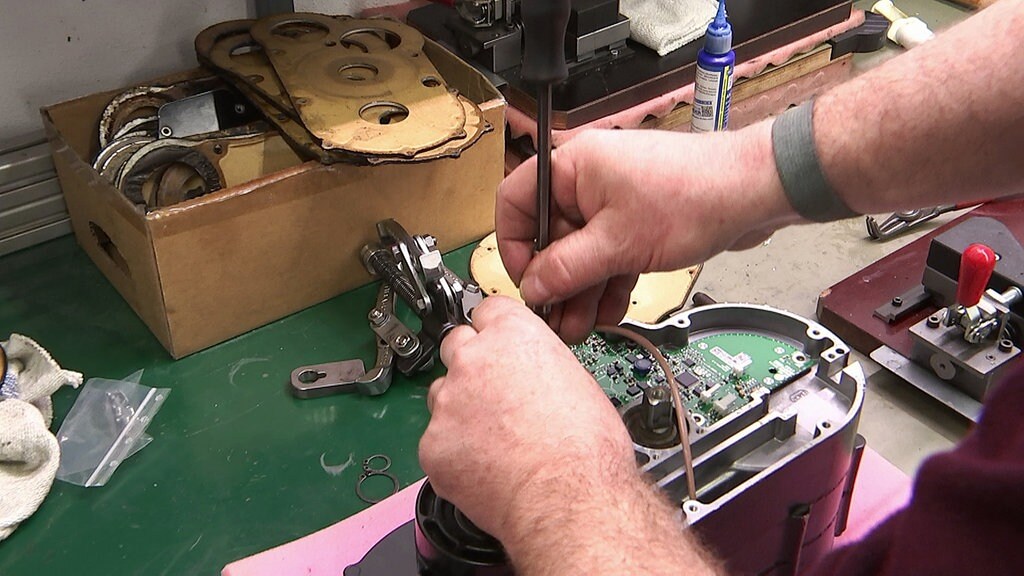
Find the location of a particular element. white table is located at coordinates (797, 275).